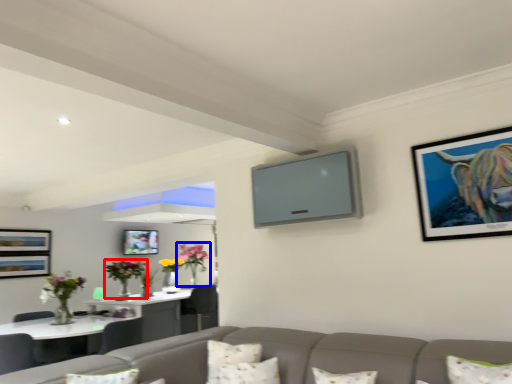
Question: Which object appears closest to the camera in this image, floral arrangement (highlighted by a red box) or floral arrangement (highlighted by a blue box)?

Choices:
 (A) floral arrangement
 (B) floral arrangement

Answer: (A)